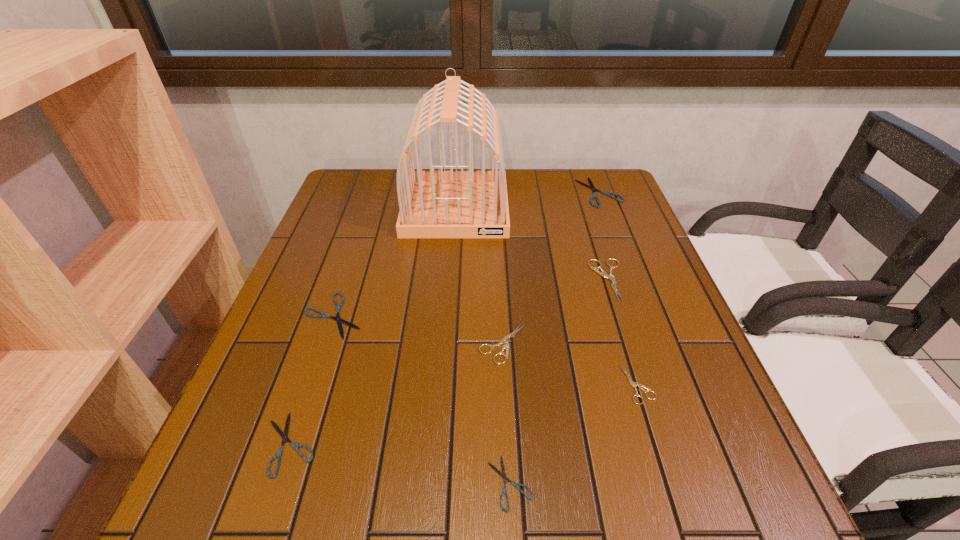
Locate an element on the screen. free location located on the right of the third biggest black shears is located at coordinates (451, 444).

Identify the location of vacant region located on the right of the smallest black shears. (588, 483).

Locate an element on the screen. birdcage situated at the far edge is located at coordinates (433, 204).

Find the location of a particular element. shears located at the far edge is located at coordinates (591, 186).

The height and width of the screenshot is (540, 960). I want to click on object present at the near left corner, so click(284, 435).

Find the location of a particular element. The width and height of the screenshot is (960, 540). object that is positioned at the far right corner is located at coordinates (x=591, y=186).

The width and height of the screenshot is (960, 540). In order to click on vacant space at the far edge in this screenshot , I will do `click(561, 171)`.

In order to click on blank space at the near edge of the desktop in this screenshot , I will do `click(316, 516)`.

This screenshot has height=540, width=960. Identify the location of free location at the left edge. (300, 340).

Identify the location of vacant space at the right edge of the desktop. Image resolution: width=960 pixels, height=540 pixels. (640, 269).